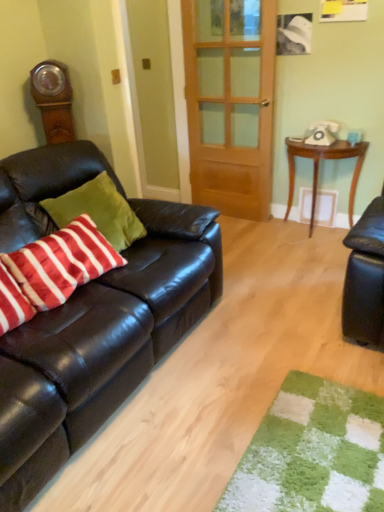
Question: Considering the positions of white plastic phone at upper right and wooden door at center in the image, is white plastic phone at upper right bigger or smaller than wooden door at center?

Choices:
 (A) big
 (B) small

Answer: (B)

Question: From the image's perspective, relative to wooden door at center, is white plastic phone at upper right above or below?

Choices:
 (A) below
 (B) above

Answer: (A)

Question: Considering the real-world distances, which object is closest to the wooden table at right?

Choices:
 (A) velvety red and white striped pillow at left, the first pillow viewed from the right
 (B) wooden door at center
 (C) matte black couch at left
 (D) striped cotton pillow at left, positioned as the second pillow in right-to-left order
 (E) white plastic phone at upper right

Answer: (E)

Question: Which of these objects is positioned closest to the white plastic phone at upper right?

Choices:
 (A) velvety red and white striped pillow at left, the first pillow viewed from the right
 (B) wooden door at center
 (C) striped cotton pillow at left, positioned as the second pillow in right-to-left order
 (D) wooden table at right
 (E) matte black couch at left

Answer: (D)